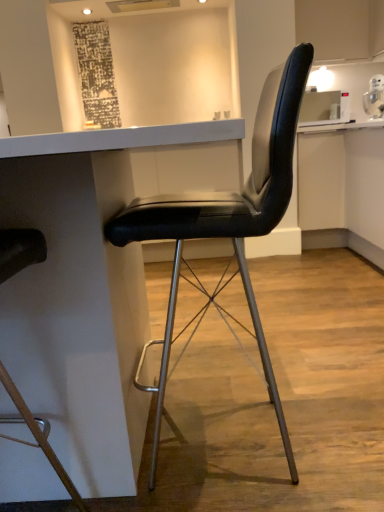
Question: In which direction should I rotate to look at black leather chair at center, which is the 2th chair in right-to-left order?

Choices:
 (A) left
 (B) right

Answer: (A)

Question: Is black leather chair at center, the 2th chair positioned from the left, bigger than white glossy table at center?

Choices:
 (A) yes
 (B) no

Answer: (B)

Question: Can you confirm if black leather chair at center, the 2th chair positioned from the left, is smaller than white glossy table at center?

Choices:
 (A) no
 (B) yes

Answer: (B)

Question: Is black leather chair at center, the 2th chair positioned from the left, shorter than white glossy table at center?

Choices:
 (A) yes
 (B) no

Answer: (B)

Question: Is black leather chair at center, the 1th chair when ordered from right to left, not near white glossy table at center?

Choices:
 (A) yes
 (B) no

Answer: (B)

Question: From a real-world perspective, is black leather chair at center, the 1th chair when ordered from right to left, physically above white glossy table at center?

Choices:
 (A) yes
 (B) no

Answer: (A)

Question: Is the depth of black leather chair at center, the 2th chair positioned from the left, greater than that of white glossy table at center?

Choices:
 (A) yes
 (B) no

Answer: (A)

Question: From a real-world perspective, is white glossy table at center under black leather chair at center, the first chair positioned from the left?

Choices:
 (A) yes
 (B) no

Answer: (A)

Question: Can you confirm if white glossy table at center is thinner than black leather chair at center, the first chair positioned from the left?

Choices:
 (A) yes
 (B) no

Answer: (B)

Question: Considering the relative sizes of white glossy table at center and black leather chair at center, which is the 2th chair in right-to-left order, in the image provided, is white glossy table at center shorter than black leather chair at center, which is the 2th chair in right-to-left order,?

Choices:
 (A) yes
 (B) no

Answer: (A)

Question: Is white glossy table at center facing towards black leather chair at center, the first chair positioned from the left?

Choices:
 (A) yes
 (B) no

Answer: (A)

Question: Is the position of white glossy table at center less distant than that of black leather chair at center, which is the 2th chair in right-to-left order?

Choices:
 (A) no
 (B) yes

Answer: (A)

Question: Can you confirm if white glossy table at center is bigger than black leather chair at center, which is the 2th chair in right-to-left order?

Choices:
 (A) yes
 (B) no

Answer: (A)

Question: Can you confirm if black leather chair at center, which is the 2th chair in right-to-left order, is smaller than black leather chair at center, the 1th chair when ordered from right to left?

Choices:
 (A) no
 (B) yes

Answer: (B)